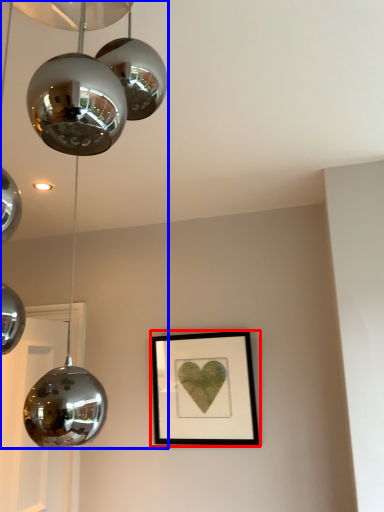
Question: Which point is further to the camera, picture frame (highlighted by a red box) or lamp (highlighted by a blue box)?

Choices:
 (A) picture frame
 (B) lamp

Answer: (A)